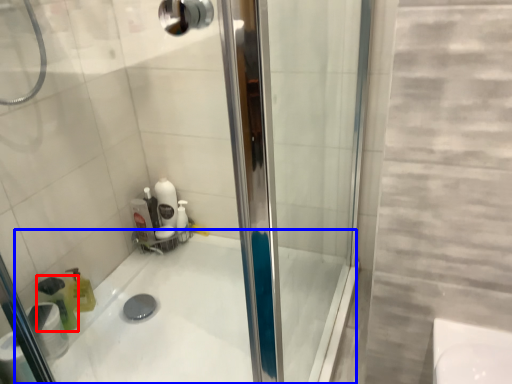
Question: Which object is further to the camera taking this photo, cleaning product (highlighted by a red box) or bath (highlighted by a blue box)?

Choices:
 (A) cleaning product
 (B) bath

Answer: (A)